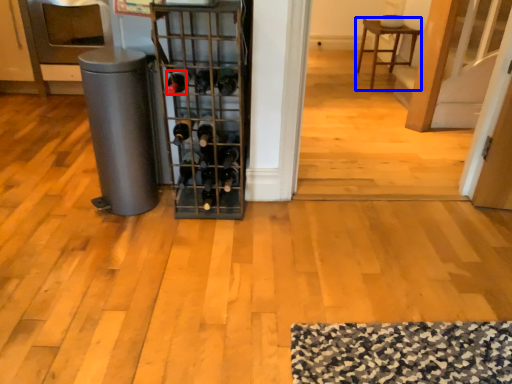
Question: Among these objects, which one is nearest to the camera, wine bottle (highlighted by a red box) or furniture (highlighted by a blue box)?

Choices:
 (A) wine bottle
 (B) furniture

Answer: (A)